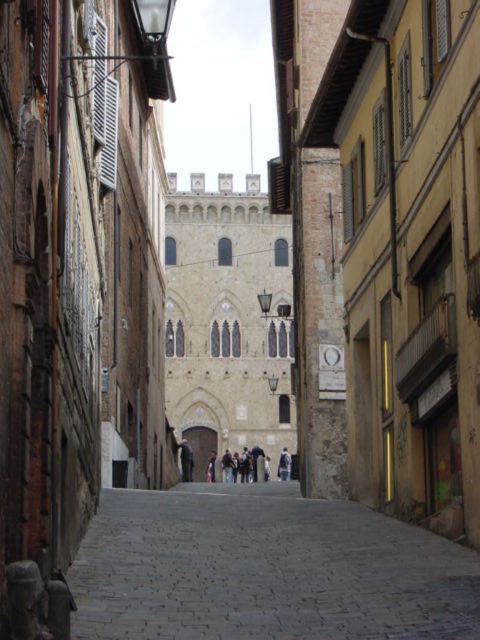
You are standing at the entrance of the narrow cobblestone street and want to walk towards the grand medieval structure at the end. The path is marked by a point at coordinates (265,570), which represents the gray cobblestone path at center. Which direction should you walk to stay on the gray cobblestone path at center?

You should walk straight ahead towards the grand medieval structure at the end since the gray cobblestone path at center is located at the coordinates (265,570), which is directly in front of you.

You are a tourist standing at the entrance of the narrow cobblestone street. You see a gray cobblestone path at center and a dark brown leather jacket at center. Which object is positioned to the right side of the other?

The gray cobblestone path at center is to the right of dark brown leather jacket at center.